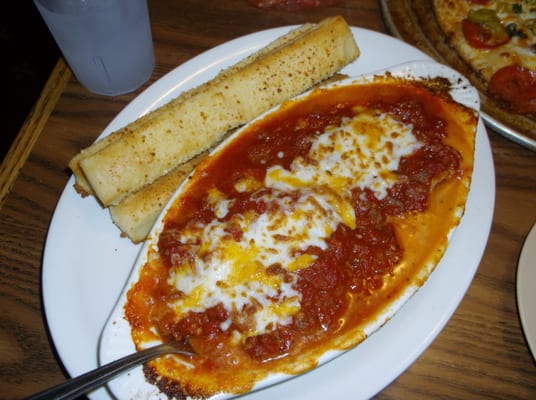
Where is `boat shaped white plate`? boat shaped white plate is located at coordinates (390, 306).